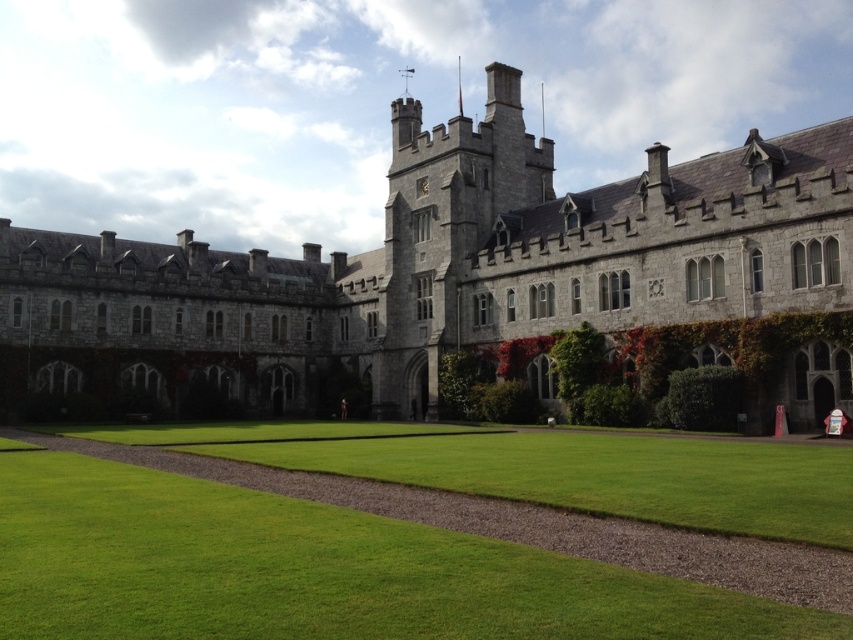
You are standing in front of a historic building and notice a specific point marked at coordinates point (437,268). Based on the scene description, can you identify which part of the building this point corresponds to?

The point (437,268) is located on the gray stone castle at center.

You are a drone operator tasked with capturing aerial footage of the gray stone castle at center. The drone must fly from the north to the south, passing directly over the castle. Given that the castle is positioned at coordinates point 0.419, 0.513, what is the approximate latitude and longitude of the castle?

The gray stone castle at center is located at point (437, 268), so the latitude and longitude would be approximately 0.419 and 0.513 respectively.

You are a drone operator tasked with capturing aerial footage of the gray stone castle at center and the green grass at center. Your drone has a maximum flight range of 40 meters. Can you film both locations without needing to recharge the drone?

The gray stone castle at center and green grass at center are 41.28 meters apart. Since the distance exceeds the drone maximum flight range of 40 meters, you cannot film both locations without needing to recharge the drone.